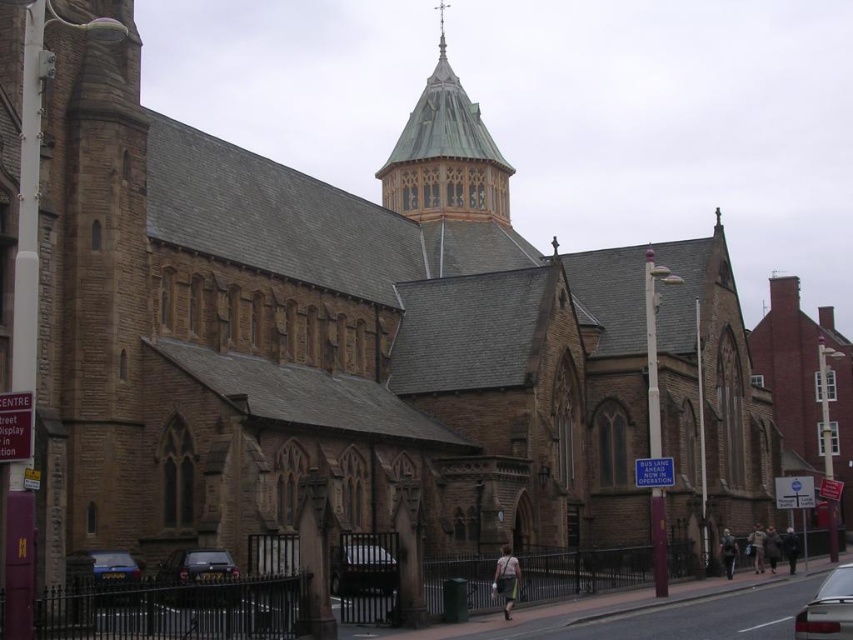
In the scene shown: You are a visitor parking your car in the church parking lot. You have two cars to park, the dark gray metallic car at lower left and the metallic silver car at lower right. Which car can fit into a parking space that is only 1.8 meters wide?

The dark gray metallic car at lower left is thinner than the metallic silver car at lower right, so it can fit into the 1.8 meters wide parking space.

You are a photographer planning to take a wide shot of the church. You need to ensure that both the green copper roof at upper center and the dark gray metallic car at lower left are fully visible in the frame. Based on their sizes, which object should you prioritize positioning closer to the camera to maintain their relative proportions?

The green copper roof at upper center has a larger width than the dark gray metallic car at lower left. To maintain their relative proportions, you should prioritize positioning the dark gray metallic car at lower left closer to the camera since it is smaller and needs to be enlarged in the frame to match the scale of the larger green copper roof at upper center.